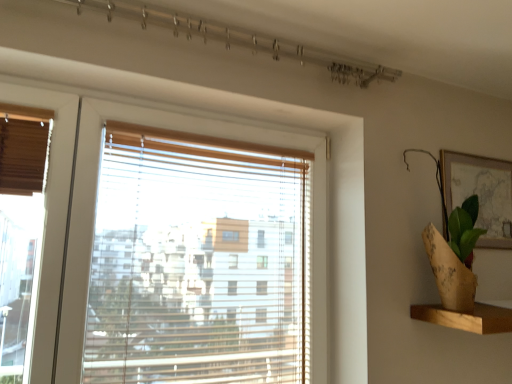
Question: Does burlap wrapped plant at right turn towards matte gold picture frame at upper right?

Choices:
 (A) no
 (B) yes

Answer: (A)

Question: Considering the relative sizes of burlap wrapped plant at right and matte gold picture frame at upper right in the image provided, is burlap wrapped plant at right smaller than matte gold picture frame at upper right?

Choices:
 (A) yes
 (B) no

Answer: (B)

Question: Is burlap wrapped plant at right outside of matte gold picture frame at upper right?

Choices:
 (A) no
 (B) yes

Answer: (B)

Question: From the image's perspective, is burlap wrapped plant at right beneath matte gold picture frame at upper right?

Choices:
 (A) no
 (B) yes

Answer: (B)

Question: Is burlap wrapped plant at right not close to matte gold picture frame at upper right?

Choices:
 (A) yes
 (B) no

Answer: (B)

Question: Is burlap wrapped plant at right wider or thinner than transparent plastic blinds at center?

Choices:
 (A) thin
 (B) wide

Answer: (B)

Question: Relative to transparent plastic blinds at center, is burlap wrapped plant at right in front or behind?

Choices:
 (A) behind
 (B) front

Answer: (A)

Question: From the image's perspective, is burlap wrapped plant at right above or below transparent plastic blinds at center?

Choices:
 (A) below
 (B) above

Answer: (B)

Question: In the image, is burlap wrapped plant at right on the left side or the right side of transparent plastic blinds at center?

Choices:
 (A) left
 (B) right

Answer: (B)

Question: From the image's perspective, is wooden at right above or below matte gold picture frame at upper right?

Choices:
 (A) below
 (B) above

Answer: (A)

Question: Does point (418, 309) appear closer or farther from the camera than point (457, 157)?

Choices:
 (A) closer
 (B) farther

Answer: (A)

Question: In terms of height, does wooden at right look taller or shorter compared to matte gold picture frame at upper right?

Choices:
 (A) tall
 (B) short

Answer: (B)

Question: Is wooden at right inside the boundaries of matte gold picture frame at upper right, or outside?

Choices:
 (A) inside
 (B) outside

Answer: (B)

Question: Is burlap wrapped plant at right taller or shorter than matte gold picture frame at upper right?

Choices:
 (A) tall
 (B) short

Answer: (A)

Question: From the image's perspective, is burlap wrapped plant at right above or below matte gold picture frame at upper right?

Choices:
 (A) above
 (B) below

Answer: (B)